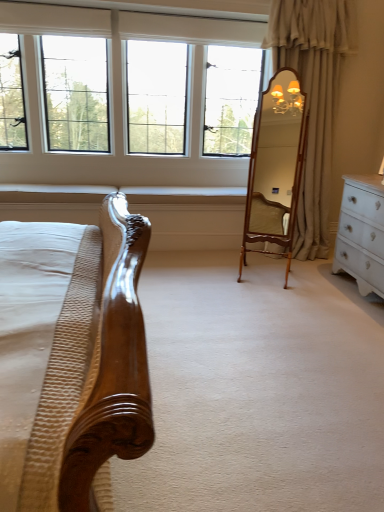
Question: Is clear glass windows at upper center to the left of wooden mirror at center from the viewer's perspective?

Choices:
 (A) no
 (B) yes

Answer: (B)

Question: Is clear glass windows at upper center in front of wooden mirror at center?

Choices:
 (A) no
 (B) yes

Answer: (A)

Question: Does clear glass windows at upper center touch wooden mirror at center?

Choices:
 (A) no
 (B) yes

Answer: (A)

Question: From the image's perspective, is clear glass windows at upper center over wooden mirror at center?

Choices:
 (A) yes
 (B) no

Answer: (A)

Question: Is clear glass windows at upper center far away from wooden mirror at center?

Choices:
 (A) yes
 (B) no

Answer: (A)

Question: From a real-world perspective, is clear glass windows at upper center positioned over wooden mirror at center based on gravity?

Choices:
 (A) no
 (B) yes

Answer: (B)

Question: Is wooden mirror at center bigger than beige fabric curtain at right?

Choices:
 (A) no
 (B) yes

Answer: (A)

Question: Is wooden mirror at center not close to beige fabric curtain at right?

Choices:
 (A) no
 (B) yes

Answer: (A)

Question: From the image's perspective, is wooden mirror at center over beige fabric curtain at right?

Choices:
 (A) no
 (B) yes

Answer: (A)

Question: Is wooden mirror at center further to the viewer compared to beige fabric curtain at right?

Choices:
 (A) yes
 (B) no

Answer: (B)

Question: Is wooden mirror at center facing away from beige fabric curtain at right?

Choices:
 (A) no
 (B) yes

Answer: (B)

Question: Are wooden mirror at center and beige fabric curtain at right beside each other?

Choices:
 (A) yes
 (B) no

Answer: (B)

Question: From a real-world perspective, is clear glass windows at upper center physically below beige fabric curtain at right?

Choices:
 (A) yes
 (B) no

Answer: (B)